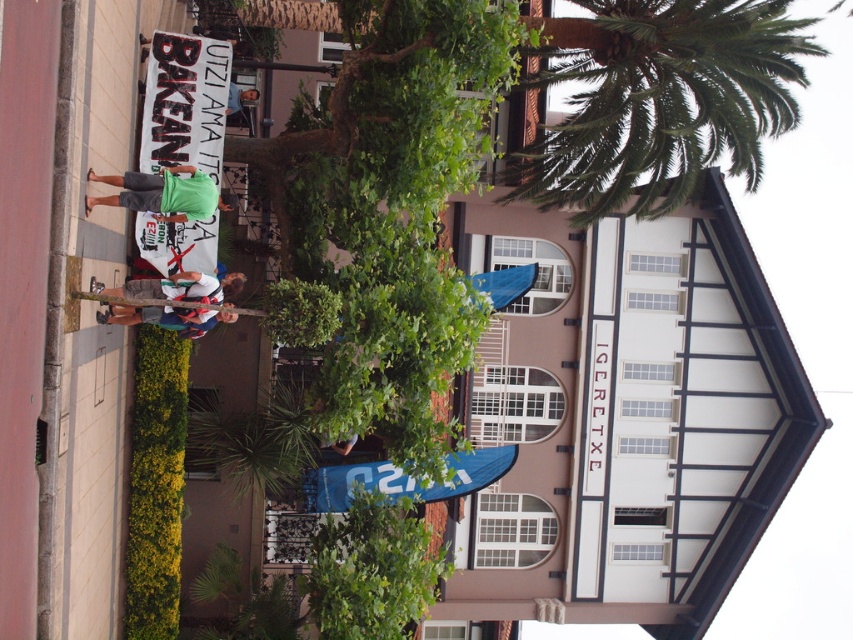
You are a customer at a clothing store and see the white cotton shirt at center and the light brown leather jacket at center displayed on a mannequin. Which item is positioned higher on the mannequin?

The white cotton shirt at center is located above the light brown leather jacket at center, so the white cotton shirt at center is positioned higher on the mannequin.

You are a delivery person who needs to place a large box on the sidewalk in front of the building. The box is wider than the light brown leather jacket at center. Can you fit it in the space where the green fabric sign at upper center is located?

The light brown leather jacket at center has a lesser width compared to the green fabric sign at upper center. Since the box is wider than the jacket, it might fit in the space where the green fabric sign at upper center is located, as that area is wider.

You are a tailor who needs to determine which garment requires more fabric for alterations. Based on the image, which item has a greater width between the green fabric shirt at center and the light brown leather jacket at center?

The green fabric shirt at center has a greater width than the light brown leather jacket at center, so it requires more fabric for alterations.